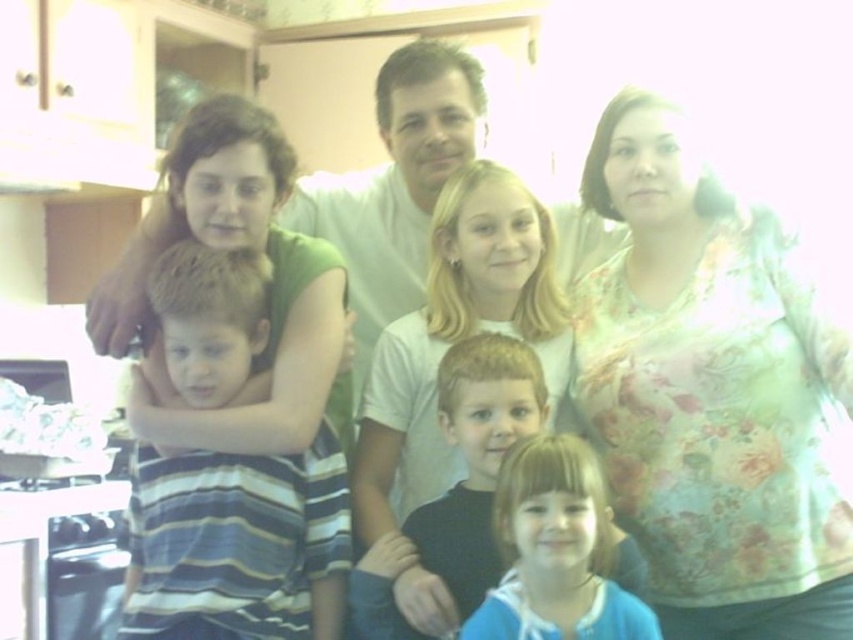
Question: Estimate the real-world distances between objects in this image. Which object is closer to the floral printed shirt at right?

Choices:
 (A) blue fabric shirt at lower center
 (B) striped fabric shirt at left

Answer: (A)

Question: Among these points, which one is farthest from the camera?

Choices:
 (A) (572, 616)
 (B) (630, 243)

Answer: (B)

Question: Does floral printed shirt at right have a smaller size compared to dark blue hoodie at center?

Choices:
 (A) no
 (B) yes

Answer: (A)

Question: Is dark blue hoodie at center positioned at the back of blue fabric shirt at lower center?

Choices:
 (A) no
 (B) yes

Answer: (B)

Question: Considering the relative positions of floral printed shirt at right and blue fabric shirt at lower center in the image provided, where is floral printed shirt at right located with respect to blue fabric shirt at lower center?

Choices:
 (A) left
 (B) right

Answer: (B)

Question: Among these objects, which one is nearest to the camera?

Choices:
 (A) blue fabric shirt at lower center
 (B) floral printed shirt at right
 (C) dark blue hoodie at center
 (D) striped fabric shirt at left

Answer: (A)